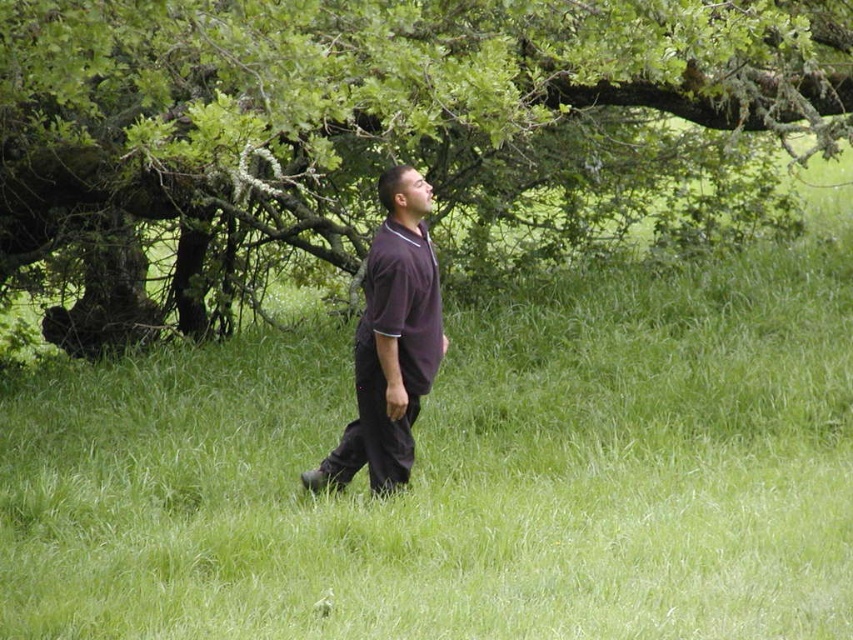
You are a drone operator trying to locate a specific point in the image. The point you need to find is point (386, 138). Based on the scene description, where would you look to find this point?

The point (386, 138) is located on the green leafy tree at upper center, so you should look at the upper central area of the tree to find it.

You are standing in a grassy area and want to take a photo of the green leafy tree at upper center. If you are at the origin point, which is the coordinate of the tree?

The green leafy tree at upper center is located at coordinate point (386, 138).

You are a painter who wants to paint the green leafy tree at upper center and the purple smooth shirt at center. You have a ladder that can reach up to 4 meters. Can you reach both objects with your ladder?

The green leafy tree at upper center and purple smooth shirt at center are 3.97 meters apart from each other. Since the ladder can reach up to 4 meters, you can reach both objects with your ladder.